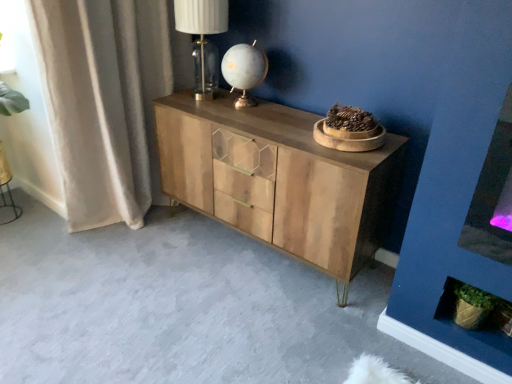
This screenshot has height=384, width=512. What do you see at coordinates (104, 102) in the screenshot?
I see `beige fabric curtain at left` at bounding box center [104, 102].

Measure the distance between point (156, 165) and camera.

They are 2.50 meters apart.

Find the location of a particular element. The width and height of the screenshot is (512, 384). matte glass table lamp at center, the 1th table lamp from the right is located at coordinates (244, 71).

This screenshot has height=384, width=512. In order to click on natural wood cabinet at center in this screenshot , I will do `click(278, 179)`.

What do you see at coordinates (278, 179) in the screenshot? This screenshot has width=512, height=384. I see `natural wood cabinet at center` at bounding box center [278, 179].

Where is `beige fabric curtain at left`? beige fabric curtain at left is located at coordinates (104, 102).

Looking at this image, considering the relative sizes of natural wood cabinet at center and translucent glass table lamp at upper center, arranged as the second table lamp when viewed from the right, in the image provided, is natural wood cabinet at center shorter than translucent glass table lamp at upper center, arranged as the second table lamp when viewed from the right,?

In fact, natural wood cabinet at center may be taller than translucent glass table lamp at upper center, arranged as the second table lamp when viewed from the right.

Who is bigger, natural wood cabinet at center or translucent glass table lamp at upper center, arranged as the second table lamp when viewed from the right?

With larger size is natural wood cabinet at center.

From a real-world perspective, which object stands above the other?

translucent glass table lamp at upper center, arranged as the second table lamp when viewed from the right.

Is natural wood cabinet at center situated inside translucent glass table lamp at upper center, which appears as the first table lamp when viewed from the left, or outside?

natural wood cabinet at center is not inside translucent glass table lamp at upper center, which appears as the first table lamp when viewed from the left, it's outside.

Are matte glass table lamp at center, acting as the second table lamp starting from the left, and natural wood cabinet at center far apart?

No, matte glass table lamp at center, acting as the second table lamp starting from the left, is not far away from natural wood cabinet at center.

Could you tell me if matte glass table lamp at center, acting as the second table lamp starting from the left, is turned towards natural wood cabinet at center?

No, matte glass table lamp at center, acting as the second table lamp starting from the left, does not turn towards natural wood cabinet at center.

Can you confirm if matte glass table lamp at center, the 1th table lamp from the right, is positioned to the left of natural wood cabinet at center?

Correct, you'll find matte glass table lamp at center, the 1th table lamp from the right, to the left of natural wood cabinet at center.

Could you measure the distance between matte glass table lamp at center, acting as the second table lamp starting from the left, and natural wood cabinet at center?

matte glass table lamp at center, acting as the second table lamp starting from the left, is 16.86 inches from natural wood cabinet at center.

Is natural wood cabinet at center facing away from matte glass table lamp at center, the 1th table lamp from the right?

natural wood cabinet at center is not turned away from matte glass table lamp at center, the 1th table lamp from the right.

From a real-world perspective, which table lamp is the 1st one above the natural wood cabinet at center? Please provide its 2D coordinates.

[(244, 71)]

In the scene shown: Who is bigger, natural wood cabinet at center or matte glass table lamp at center, acting as the second table lamp starting from the left?

Bigger between the two is natural wood cabinet at center.

From the image's perspective, is natural wood cabinet at center located beneath matte glass table lamp at center, the 1th table lamp from the right?

Yes, from the image's perspective, natural wood cabinet at center is below matte glass table lamp at center, the 1th table lamp from the right.

From a real-world perspective, who is located higher, beige fabric curtain at left or natural wood cabinet at center?

beige fabric curtain at left is physically above.

Is the depth of beige fabric curtain at left greater than that of natural wood cabinet at center?

Yes, the depth of beige fabric curtain at left is greater than that of natural wood cabinet at center.

Can you confirm if beige fabric curtain at left is positioned to the left of natural wood cabinet at center?

Yes, beige fabric curtain at left is to the left of natural wood cabinet at center.

How many degrees apart are the facing directions of beige fabric curtain at left and natural wood cabinet at center?

The facing directions of beige fabric curtain at left and natural wood cabinet at center are 89.9 degrees apart.

From the picture: Is translucent glass table lamp at upper center, which appears as the first table lamp when viewed from the left, inside the boundaries of beige fabric curtain at left, or outside?

translucent glass table lamp at upper center, which appears as the first table lamp when viewed from the left, is outside beige fabric curtain at left.

Is translucent glass table lamp at upper center, arranged as the second table lamp when viewed from the right, thinner than beige fabric curtain at left?

Indeed, translucent glass table lamp at upper center, arranged as the second table lamp when viewed from the right, has a lesser width compared to beige fabric curtain at left.

Which object is positioned more to the left, translucent glass table lamp at upper center, arranged as the second table lamp when viewed from the right, or beige fabric curtain at left?

beige fabric curtain at left is more to the left.

Based on the photo, is translucent glass table lamp at upper center, which appears as the first table lamp when viewed from the left, facing away from beige fabric curtain at left?

translucent glass table lamp at upper center, which appears as the first table lamp when viewed from the left, is not turned away from beige fabric curtain at left.

Is matte glass table lamp at center, acting as the second table lamp starting from the left, facing away from translucent glass table lamp at upper center, which appears as the first table lamp when viewed from the left?

matte glass table lamp at center, acting as the second table lamp starting from the left, is not turned away from translucent glass table lamp at upper center, which appears as the first table lamp when viewed from the left.

Can we say matte glass table lamp at center, the 1th table lamp from the right, lies outside translucent glass table lamp at upper center, which appears as the first table lamp when viewed from the left?

That's correct, matte glass table lamp at center, the 1th table lamp from the right, is outside of translucent glass table lamp at upper center, which appears as the first table lamp when viewed from the left.

The width and height of the screenshot is (512, 384). What are the coordinates of `table lamp behind the translucent glass table lamp at upper center, which appears as the first table lamp when viewed from the left` in the screenshot? It's located at [x=244, y=71].

Which of these two, matte glass table lamp at center, the 1th table lamp from the right, or translucent glass table lamp at upper center, which appears as the first table lamp when viewed from the left, stands taller?

Standing taller between the two is translucent glass table lamp at upper center, which appears as the first table lamp when viewed from the left.

This screenshot has width=512, height=384. Find the location of `the 2nd table lamp behind when counting from the beige fabric curtain at left`. the 2nd table lamp behind when counting from the beige fabric curtain at left is located at coordinates [244, 71].

Does matte glass table lamp at center, acting as the second table lamp starting from the left, come behind beige fabric curtain at left?

Yes, matte glass table lamp at center, acting as the second table lamp starting from the left, is further from the viewer.

Considering the relative sizes of matte glass table lamp at center, the 1th table lamp from the right, and beige fabric curtain at left in the image provided, is matte glass table lamp at center, the 1th table lamp from the right, taller than beige fabric curtain at left?

No.

Is matte glass table lamp at center, acting as the second table lamp starting from the left, with beige fabric curtain at left?

No, matte glass table lamp at center, acting as the second table lamp starting from the left, is not in contact with beige fabric curtain at left.

This screenshot has width=512, height=384. What are the coordinates of `chest of drawers below the translucent glass table lamp at upper center, which appears as the first table lamp when viewed from the left (from the image's perspective)` in the screenshot? It's located at (278, 179).

Find the location of a particular element. This screenshot has height=384, width=512. the chest of drawers that is under the matte glass table lamp at center, acting as the second table lamp starting from the left (from a real-world perspective) is located at coordinates (278, 179).

Estimate the real-world distances between objects in this image. Which object is closer to beige fabric curtain at left, natural wood cabinet at center or matte glass table lamp at center, acting as the second table lamp starting from the left?

Among the two, natural wood cabinet at center is located nearer to beige fabric curtain at left.

When comparing their distances from natural wood cabinet at center, does beige fabric curtain at left or matte glass table lamp at center, the 1th table lamp from the right, seem closer?

Based on the image, matte glass table lamp at center, the 1th table lamp from the right, appears to be nearer to natural wood cabinet at center.

Estimate the real-world distances between objects in this image. Which object is further from translucent glass table lamp at upper center, arranged as the second table lamp when viewed from the right, matte glass table lamp at center, the 1th table lamp from the right, or beige fabric curtain at left?

Based on the image, beige fabric curtain at left appears to be further to translucent glass table lamp at upper center, arranged as the second table lamp when viewed from the right.

Looking at the image, which one is located closer to matte glass table lamp at center, acting as the second table lamp starting from the left, translucent glass table lamp at upper center, which appears as the first table lamp when viewed from the left, or natural wood cabinet at center?

Among the two, translucent glass table lamp at upper center, which appears as the first table lamp when viewed from the left, is located nearer to matte glass table lamp at center, acting as the second table lamp starting from the left.

Which object lies nearer to the anchor point natural wood cabinet at center, beige fabric curtain at left or translucent glass table lamp at upper center, which appears as the first table lamp when viewed from the left?

Based on the image, beige fabric curtain at left appears to be nearer to natural wood cabinet at center.

Based on their spatial positions, is natural wood cabinet at center or translucent glass table lamp at upper center, arranged as the second table lamp when viewed from the right, further from matte glass table lamp at center, the 1th table lamp from the right?

The object further to matte glass table lamp at center, the 1th table lamp from the right, is natural wood cabinet at center.

Which object lies nearer to the anchor point matte glass table lamp at center, acting as the second table lamp starting from the left, beige fabric curtain at left or natural wood cabinet at center?

Among the two, natural wood cabinet at center is located nearer to matte glass table lamp at center, acting as the second table lamp starting from the left.

Based on their spatial positions, is natural wood cabinet at center or matte glass table lamp at center, the 1th table lamp from the right, closer to translucent glass table lamp at upper center, arranged as the second table lamp when viewed from the right?

matte glass table lamp at center, the 1th table lamp from the right, lies closer to translucent glass table lamp at upper center, arranged as the second table lamp when viewed from the right, than the other object.

Where is `table lamp located between beige fabric curtain at left and matte glass table lamp at center, the 1th table lamp from the right, in the left-right direction`? table lamp located between beige fabric curtain at left and matte glass table lamp at center, the 1th table lamp from the right, in the left-right direction is located at coordinates (201, 22).

The width and height of the screenshot is (512, 384). In order to click on table lamp between translucent glass table lamp at upper center, arranged as the second table lamp when viewed from the right, and natural wood cabinet at center from top to bottom in this screenshot , I will do click(x=244, y=71).